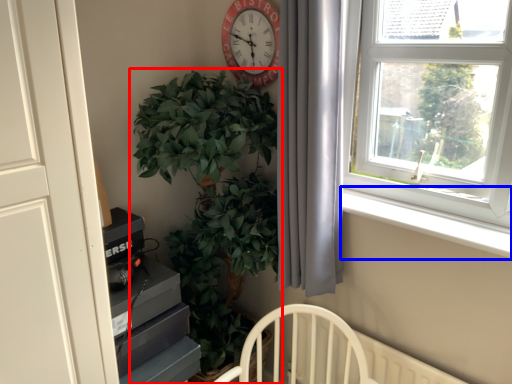
Question: Which point is closer to the camera, houseplant (highlighted by a red box) or window sill (highlighted by a blue box)?

Choices:
 (A) houseplant
 (B) window sill

Answer: (A)